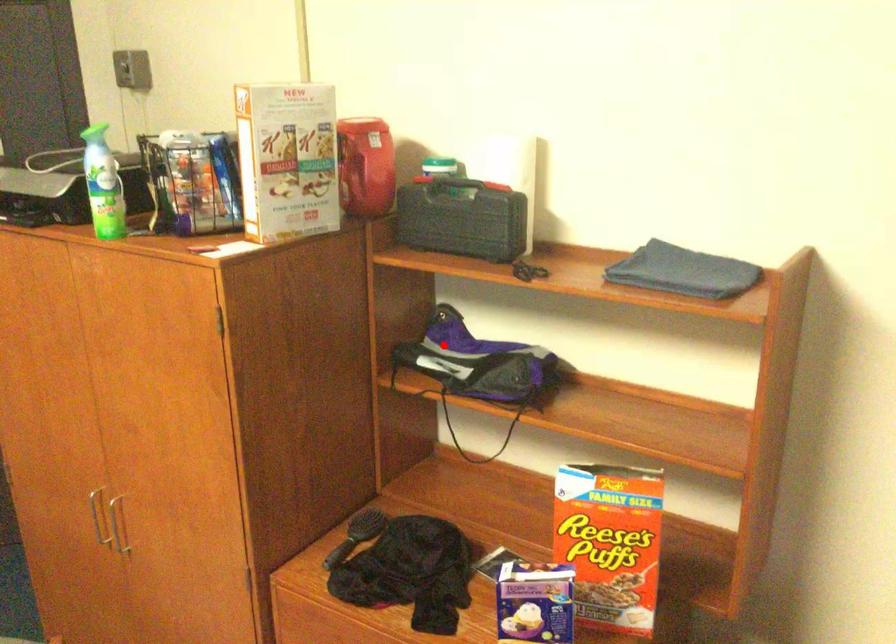
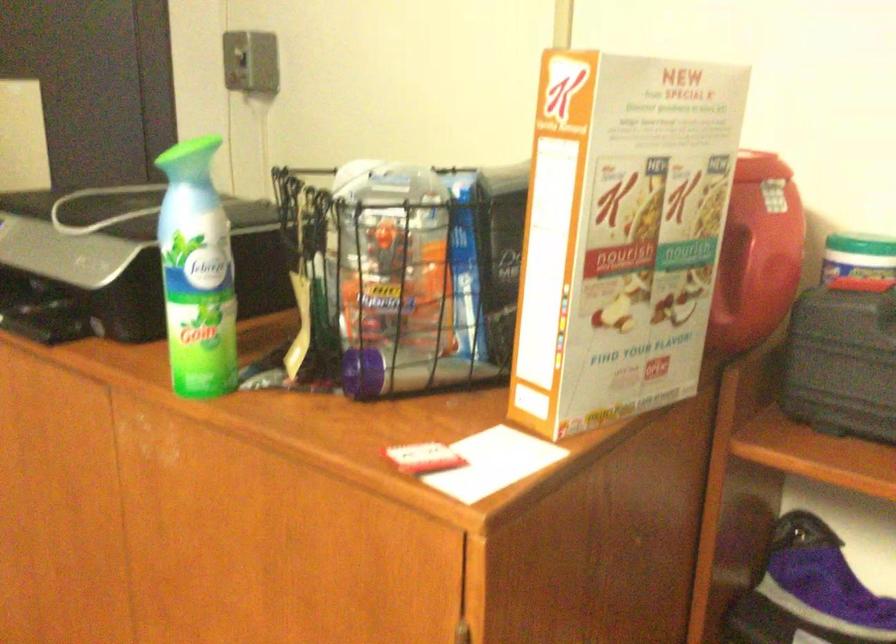
Question: I am providing you with two images of the same scene from different viewpoints. In image1, a red point is highlighted. Considering the same 3D point in image2, which of the following is correct?

Choices:
 (A) It is closer
 (B) It is farther

Answer: (A)